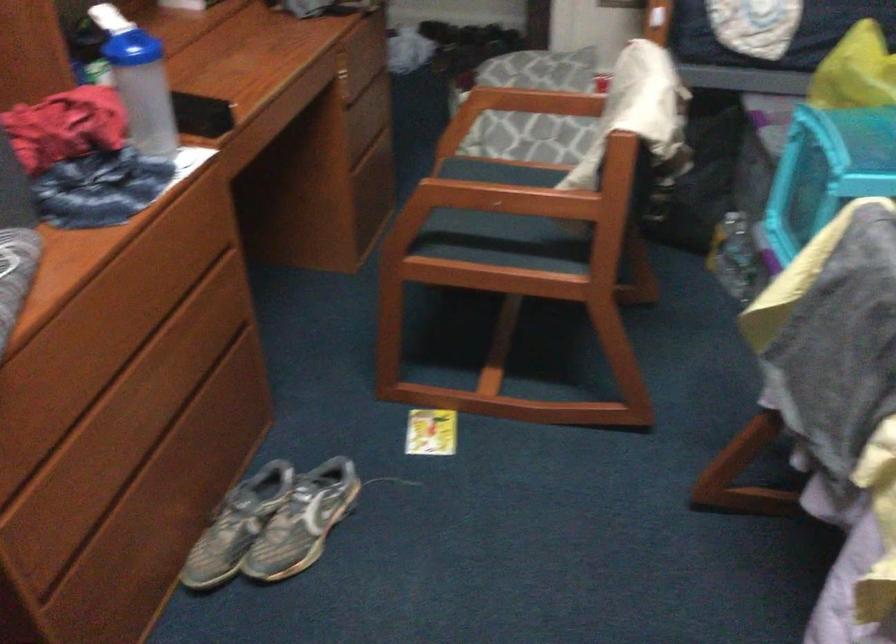
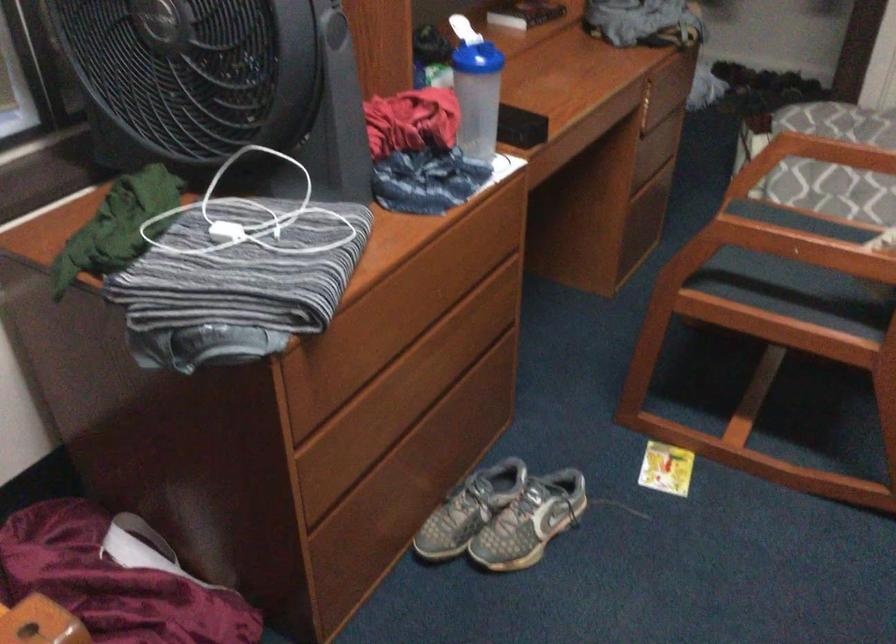
In the second image, find the point that corresponds to point 82,558 in the first image.

(343, 506)